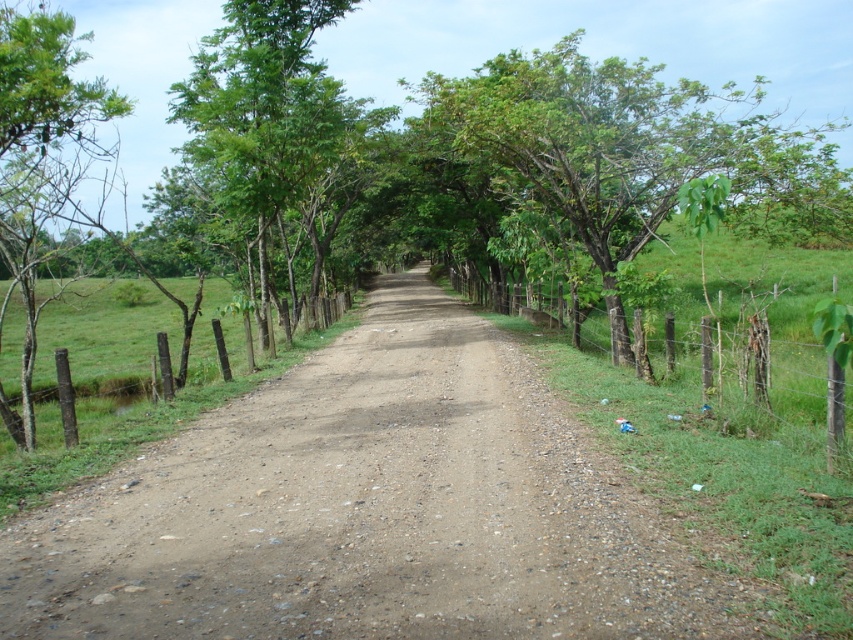
You are driving a car that is 1.8 meters wide. You come across a narrow section of the rural dirt road where the road is bordered by a green leafy tree at center and a wooden post fence at right. Can your car pass through this section without hitting either the tree or the fence?

The green leafy tree at center is wider than the wooden post fence at right. However, the question is about the width of the road itself. Since the scene description mentions the road is narrow and bordered by both objects, but the objects description only compares their widths, not the road width. Therefore, it is unclear if the car can pass without hitting either object. More information about the road width is needed.

You are standing at the starting point of the dirt road and want to reach the green leafy tree at center. According to the coordinates provided, in which direction should you walk to reach it?

The green leafy tree at center is located at point 0.231 along the x and 0.748 along the y. Since you are at the starting point, which is likely at the bottom left corner, you should walk towards the upper right direction to reach it.

Looking at this image, you are driving a car that is 4 meters wide. You need to pass through the gap between the green leafy tree at upper left and the brown wooden fence at left. Can your car fit through the gap?

The gap between the green leafy tree at upper left and the brown wooden fence at left is 8.02 meters. Since your car is only 4 meters wide, it can easily fit through the gap as the width of the gap is more than double the car width.